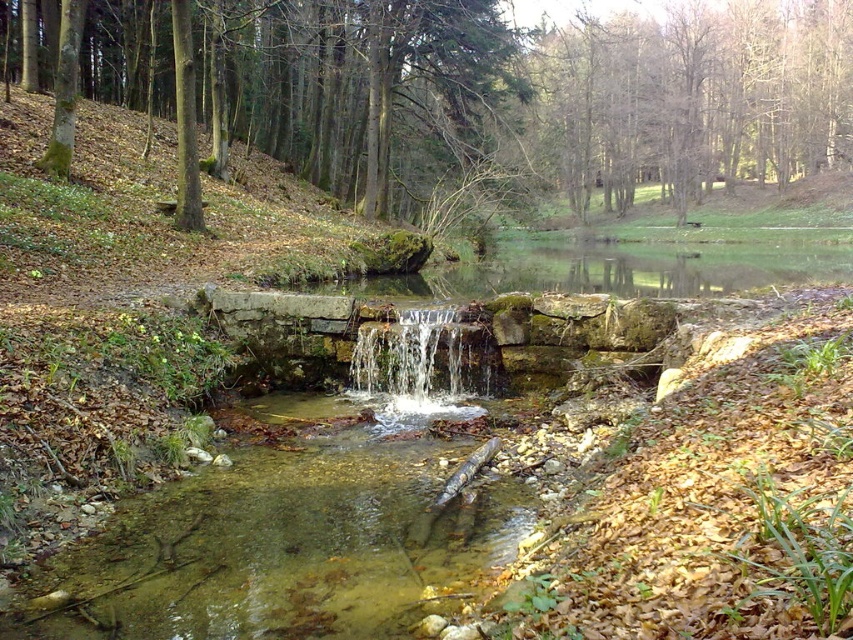
Which of these two, brown wood tree at upper center or bare wood trees at upper center, stands shorter?

bare wood trees at upper center is shorter.

Between brown wood tree at upper center and bare wood trees at upper center, which one has more height?

brown wood tree at upper center

What do you see at coordinates (531, 96) in the screenshot? I see `brown wood tree at upper center` at bounding box center [531, 96].

The height and width of the screenshot is (640, 853). In order to click on brown wood tree at upper center in this screenshot , I will do `click(531, 96)`.

Who is more forward, (584,205) or (456,336)?

Point (456,336) is in front.

Does bare wood trees at upper center appear on the left side of clear stone waterfall at center?

Incorrect, bare wood trees at upper center is not on the left side of clear stone waterfall at center.

Between point (837, 84) and point (405, 403), which one is positioned in front?

Point (405, 403) is in front.

You are a GUI agent. You are given a task and a screenshot of the screen. Output one action in this format:
    pyautogui.click(x=<x>, y=<y>)
    Task: Click on the bare wood trees at upper center
    Image resolution: width=853 pixels, height=640 pixels.
    Given the screenshot: What is the action you would take?
    pyautogui.click(x=699, y=97)

Between point (624, 42) and point (437, 403), which one is positioned behind?

Point (624, 42)

Does brown wood tree at upper center appear over clear stone waterfall at center?

Yes, brown wood tree at upper center is above clear stone waterfall at center.

Identify the location of brown wood tree at upper center. (531, 96).